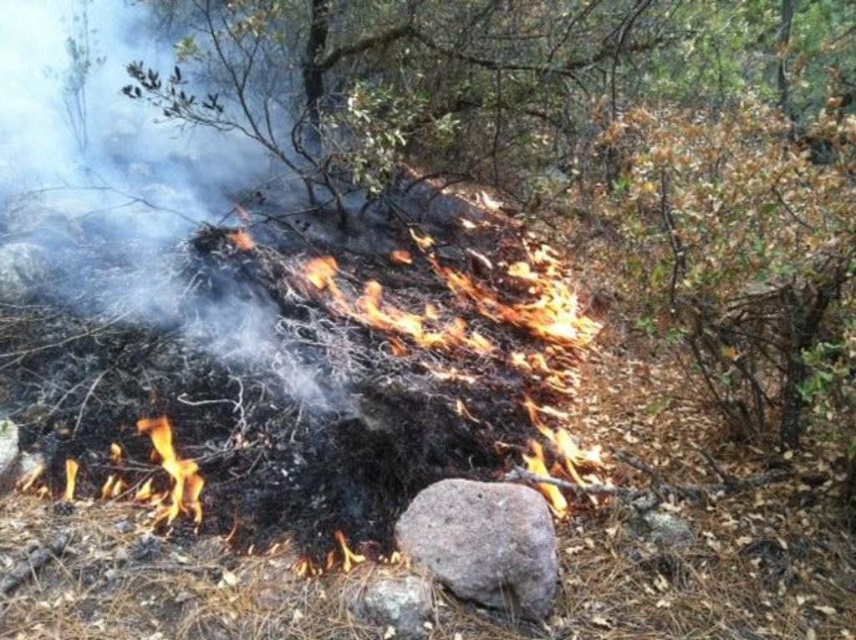
Question: Among these objects, which one is farthest from the camera?

Choices:
 (A) charred wood pile at center
 (B) gray rough rock at center

Answer: (A)

Question: In this image, where is charred wood pile at center located relative to gray rough rock at center?

Choices:
 (A) left
 (B) right

Answer: (A)

Question: Which point is closer to the camera?

Choices:
 (A) charred wood pile at center
 (B) gray rough rock at center

Answer: (B)

Question: Which point is farther from the camera taking this photo?

Choices:
 (A) (247, 392)
 (B) (495, 532)

Answer: (A)

Question: Can you confirm if charred wood pile at center is wider than gray rough rock at center?

Choices:
 (A) no
 (B) yes

Answer: (B)

Question: Can you confirm if charred wood pile at center is positioned below gray rough rock at center?

Choices:
 (A) yes
 (B) no

Answer: (B)